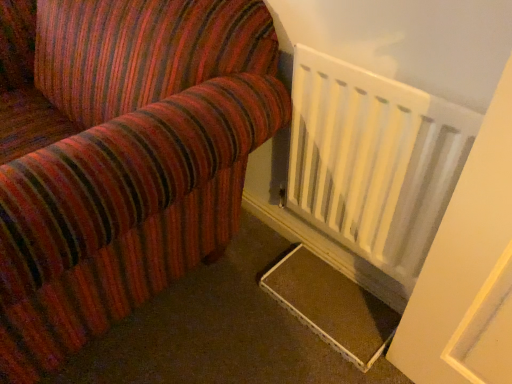
Question: Would you say white matte radiator at lower right is a long distance from brown textured mat at lower right?

Choices:
 (A) yes
 (B) no

Answer: (B)

Question: Is white matte radiator at lower right further to the viewer compared to brown textured mat at lower right?

Choices:
 (A) yes
 (B) no

Answer: (B)

Question: Does white matte radiator at lower right have a larger size compared to brown textured mat at lower right?

Choices:
 (A) no
 (B) yes

Answer: (B)

Question: Is white matte radiator at lower right looking in the opposite direction of brown textured mat at lower right?

Choices:
 (A) yes
 (B) no

Answer: (B)

Question: From the image's perspective, is white matte radiator at lower right beneath brown textured mat at lower right?

Choices:
 (A) yes
 (B) no

Answer: (B)

Question: Can you confirm if white matte radiator at lower right is positioned to the left of brown textured mat at lower right?

Choices:
 (A) yes
 (B) no

Answer: (B)

Question: Considering the relative sizes of brown textured mat at lower right and white matte radiator at lower right in the image provided, is brown textured mat at lower right wider than white matte radiator at lower right?

Choices:
 (A) no
 (B) yes

Answer: (B)

Question: Can you confirm if brown textured mat at lower right is positioned to the right of white matte radiator at lower right?

Choices:
 (A) yes
 (B) no

Answer: (B)

Question: Does brown textured mat at lower right have a lesser width compared to white matte radiator at lower right?

Choices:
 (A) no
 (B) yes

Answer: (A)

Question: Does brown textured mat at lower right have a lesser height compared to white matte radiator at lower right?

Choices:
 (A) yes
 (B) no

Answer: (A)

Question: Is brown textured mat at lower right facing towards white matte radiator at lower right?

Choices:
 (A) no
 (B) yes

Answer: (A)

Question: Is brown textured mat at lower right located outside white matte radiator at lower right?

Choices:
 (A) no
 (B) yes

Answer: (B)

Question: Is brown textured mat at lower right inside the boundaries of white matte radiator at lower right, or outside?

Choices:
 (A) inside
 (B) outside

Answer: (B)